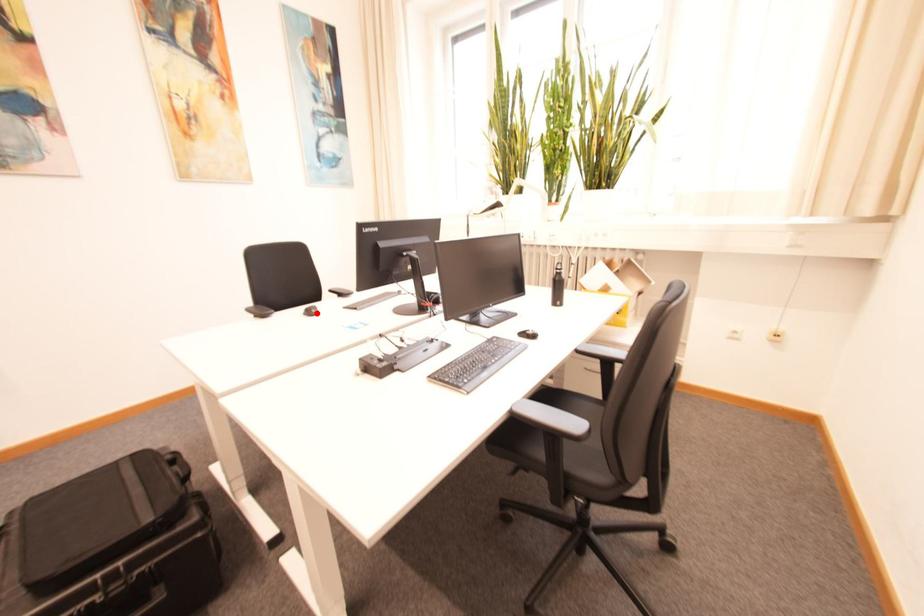
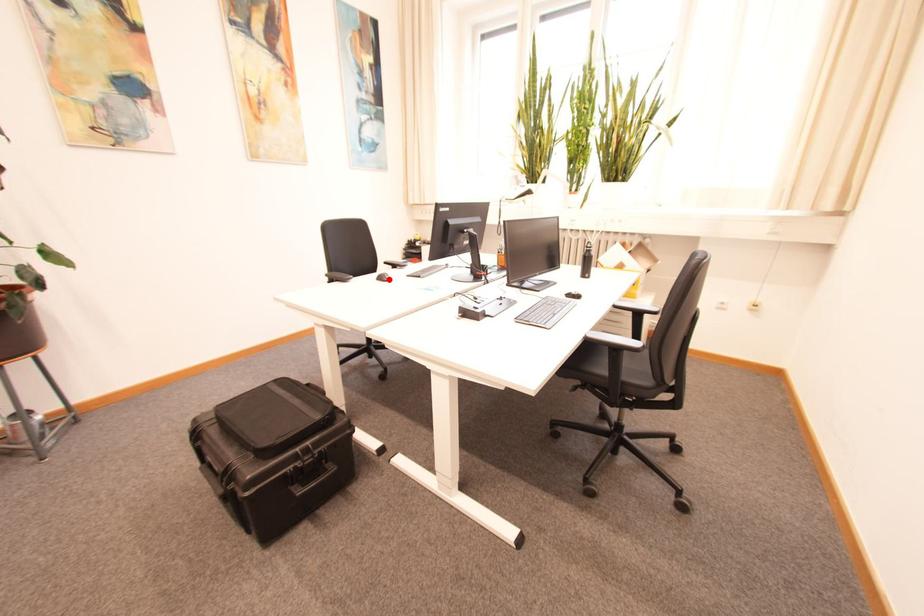
I am providing you with two images of the same scene from different viewpoints. A red point is marked on the first image and another point is marked on the second image. Do the highlighted points in image1 and image2 indicate the same real-world spot?

Yes